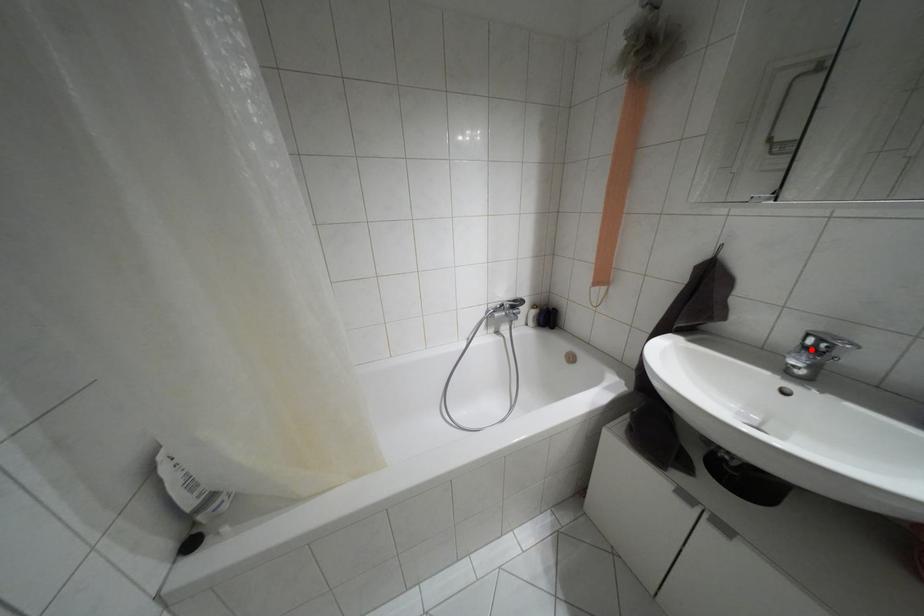
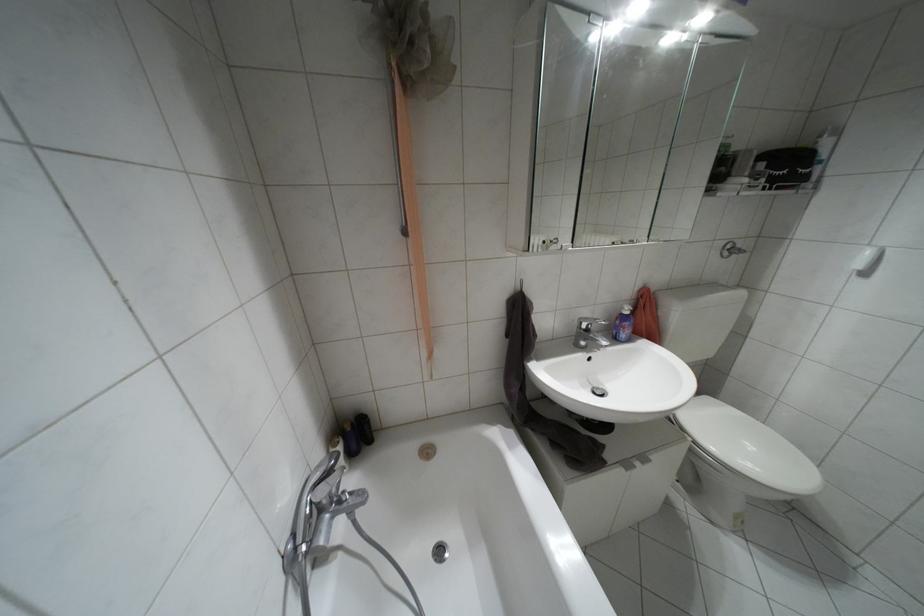
Where in the second image is the point corresponding to the highlighted location from the first image?

(587, 330)